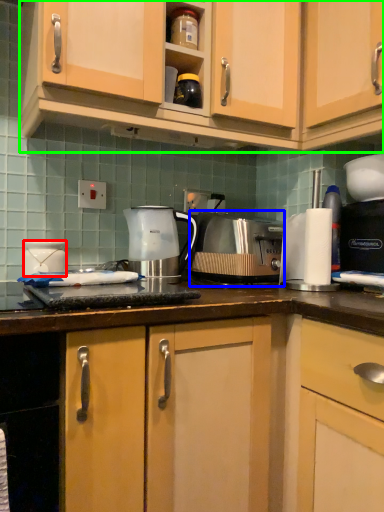
Question: Which object is the closest to the appliance (highlighted by a red box)? Choose among these: toaster (highlighted by a blue box) or cabinetry (highlighted by a green box).

Choices:
 (A) toaster
 (B) cabinetry

Answer: (A)